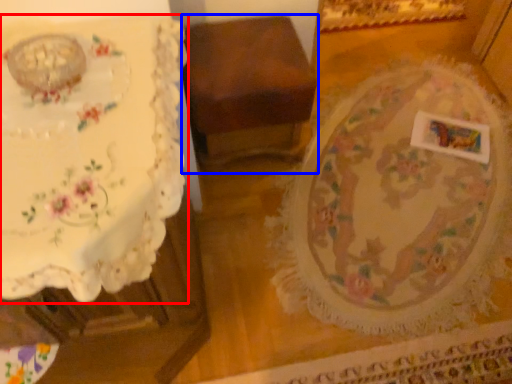
Question: Which object appears closest to the camera in this image, table (highlighted by a red box) or furniture (highlighted by a blue box)?

Choices:
 (A) table
 (B) furniture

Answer: (A)